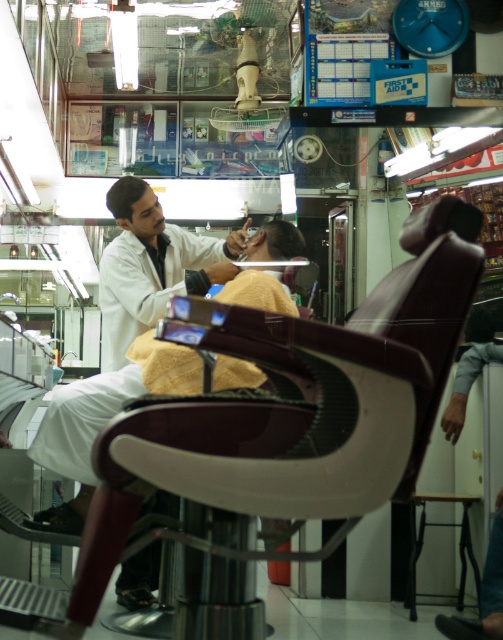
In the scene shown: You are a customer in a barbershop and you want to choose a hairstyle that is shorter. Looking at the shiny black hair at center and the dark brown hair at center, which one should you choose?

The shiny black hair at center has a lesser height compared to dark brown hair at center, so you should choose the shiny black hair at center for a shorter hairstyle.

You are a customer entering the barbershop and see the white matte barber at center and the metallic stool at lower right. Which object is located to the left of the other?

The white matte barber at center is positioned on the left side of metallic stool at lower right.

You are a customer entering the barbershop and want to approach the barber. Which object should you move towards first, the white matte barber at center or the metallic stool at lower right?

You should move towards the white matte barber at center first because it is closer to you than the metallic stool at lower right.